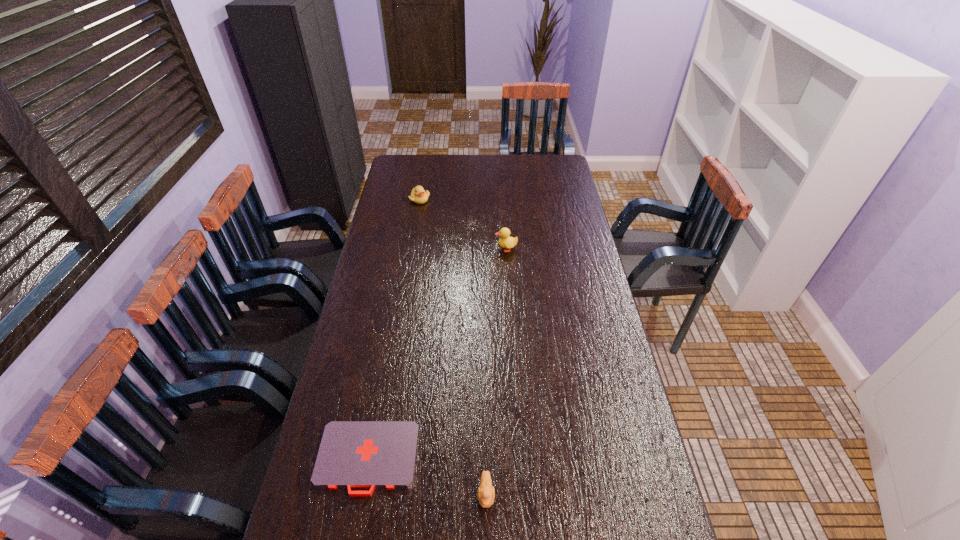
At what (x,y) coordinates should I click in order to perform the action: click on the third nearest object. Please return your answer as a coordinate pair (x, y). Looking at the image, I should click on (505, 241).

At what (x,y) coordinates should I click in order to perform the action: click on the rightmost duckling. Please return your answer as a coordinate pair (x, y). Looking at the image, I should click on (505, 241).

Identify the location of the farthest duckling. (418, 195).

Identify the location of the leftmost duckling. (418, 195).

I want to click on the shortest duckling, so click(x=486, y=492).

Locate an element on the screen. This screenshot has height=540, width=960. the nearest duckling is located at coordinates (x=486, y=492).

Locate an element on the screen. This screenshot has width=960, height=540. the shortest object is located at coordinates (372, 454).

Where is `free space located 0.230m on the front-facing side of the rightmost duckling`? The width and height of the screenshot is (960, 540). free space located 0.230m on the front-facing side of the rightmost duckling is located at coordinates (439, 249).

Image resolution: width=960 pixels, height=540 pixels. What are the coordinates of `free space located on the front-facing side of the rightmost duckling` in the screenshot? It's located at (432, 249).

At what (x,y) coordinates should I click in order to perform the action: click on vacant space positioned 0.150m on the front-facing side of the rightmost duckling. Please return your answer as a coordinate pair (x, y). The image size is (960, 540). Looking at the image, I should click on (458, 249).